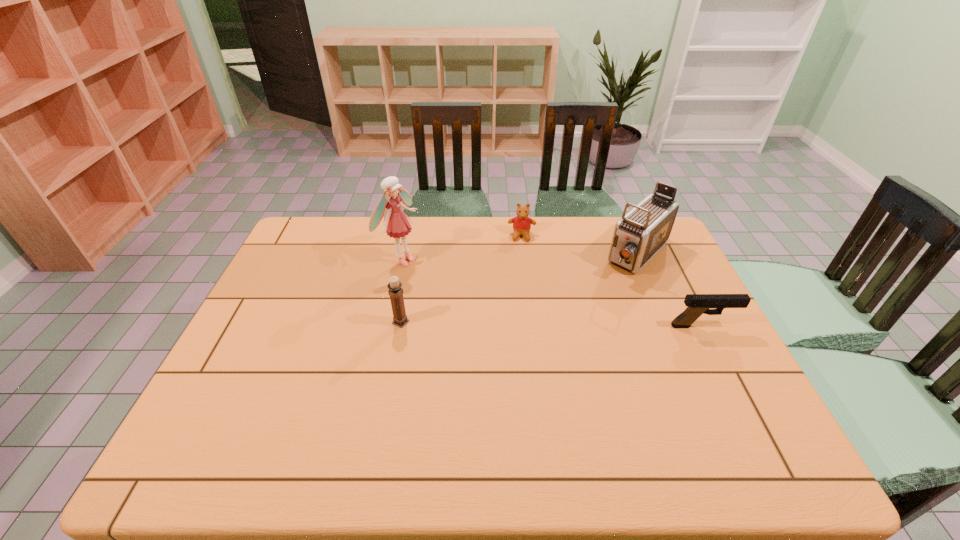
Find the location of a particular element. The width and height of the screenshot is (960, 540). vacant position located 0.220m on the front-facing side of the teddy bear is located at coordinates (520, 285).

The image size is (960, 540). Find the location of `vacant space situated 0.090m on the front-facing side of the teddy bear`. vacant space situated 0.090m on the front-facing side of the teddy bear is located at coordinates (521, 259).

Image resolution: width=960 pixels, height=540 pixels. I want to click on free space located on the front-facing side of the tallest object, so (x=472, y=294).

Locate an element on the screen. The image size is (960, 540). free spot located 0.380m on the front-facing side of the tallest object is located at coordinates (518, 315).

Where is `free region located 0.240m on the front-facing side of the tallest object`? The height and width of the screenshot is (540, 960). free region located 0.240m on the front-facing side of the tallest object is located at coordinates (478, 296).

At what (x,y) coordinates should I click in order to perform the action: click on camcorder positioned at the far edge. Please return your answer as a coordinate pair (x, y). The image size is (960, 540). Looking at the image, I should click on pyautogui.click(x=640, y=233).

At what (x,y) coordinates should I click in order to perform the action: click on teddy bear present at the far edge. Please return your answer as a coordinate pair (x, y). This screenshot has height=540, width=960. Looking at the image, I should click on (522, 223).

Where is `doll present at the far edge`? This screenshot has width=960, height=540. doll present at the far edge is located at coordinates (x=398, y=225).

Find the location of a particular element. The width and height of the screenshot is (960, 540). pistol situated at the right edge is located at coordinates (698, 304).

Locate an element on the screen. camcorder that is at the right edge is located at coordinates (640, 233).